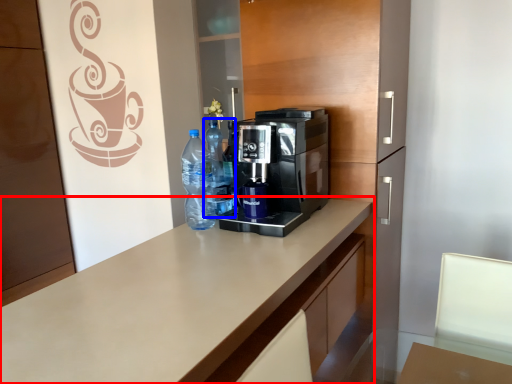
Question: Which object appears farthest to the camera in this image, countertop (highlighted by a red box) or bottle (highlighted by a blue box)?

Choices:
 (A) countertop
 (B) bottle

Answer: (B)